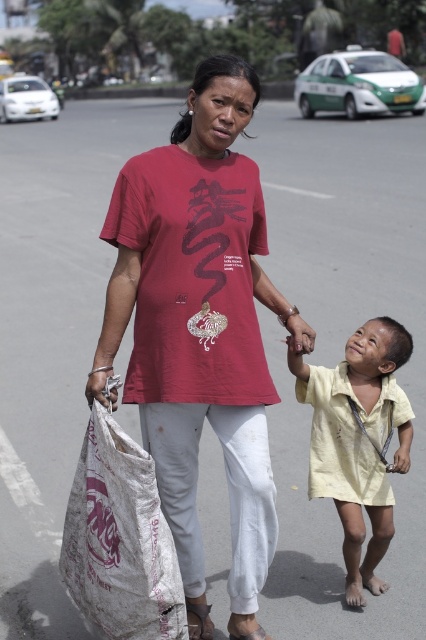
Measure the distance between point (81, 484) and camera.

Point (81, 484) and camera are 3.28 meters apart.

Is white woven bag at lower left positioned behind yellow cotton shirt at lower right?

No.

Locate an element on the screen. The image size is (426, 640). white woven bag at lower left is located at coordinates (120, 540).

Does matte red t-shirt at center have a greater width compared to white woven bag at lower left?

Yes.

Who is more forward, (236, 61) or (172, 630)?

Point (172, 630) is more forward.

You are a GUI agent. You are given a task and a screenshot of the screen. Output one action in this format:
    pyautogui.click(x=<x>, y=<y>)
    Task: Click on the matte red t-shirt at center
    Image resolution: width=426 pixels, height=640 pixels.
    Given the screenshot: What is the action you would take?
    pyautogui.click(x=199, y=328)

Is matte red t-shirt at center above yellow cotton shirt at lower right?

Indeed, matte red t-shirt at center is positioned over yellow cotton shirt at lower right.

Between point (123, 330) and point (374, 397), which one is positioned in front?

Point (123, 330) is in front.

I want to click on matte red t-shirt at center, so click(x=199, y=328).